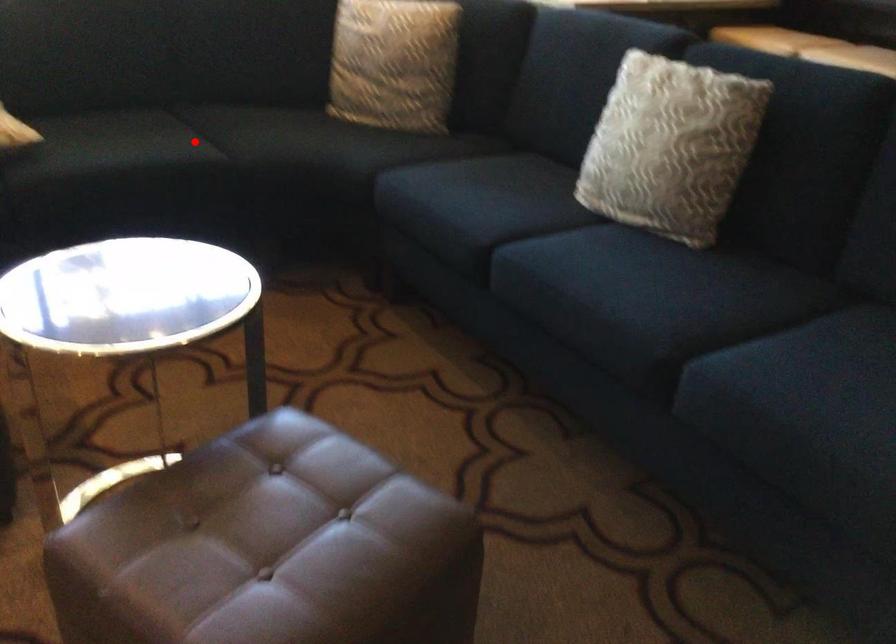
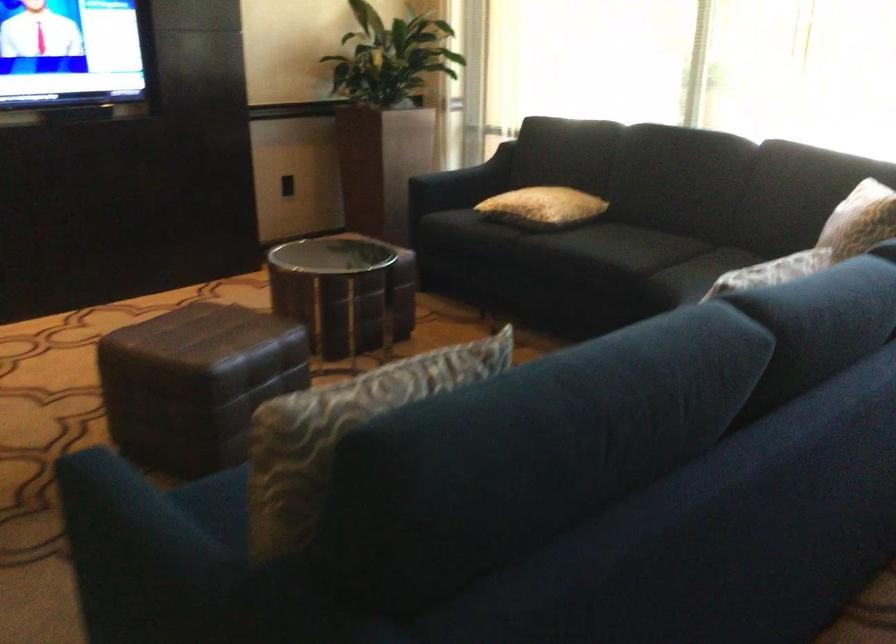
Question: I am providing you with two images of the same scene from different viewpoints. A red point is marked on the first image. At the location where the point appears in image 1, is it still visible in image 2?

Choices:
 (A) Yes
 (B) No

Answer: (A)